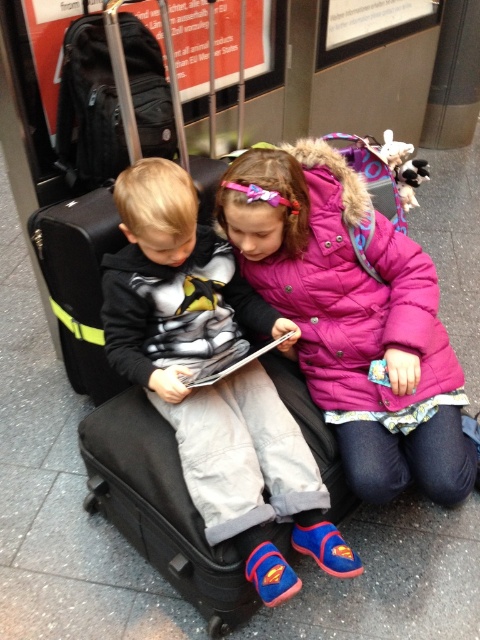
You are standing in the public transportation area and want to know which of the two points, point [264,268] or point [244,444], is closer to you. Based on the image, which point is nearer?

Point [264,268] is further to the camera than point [244,444], so the closer point to you is point [244,444].